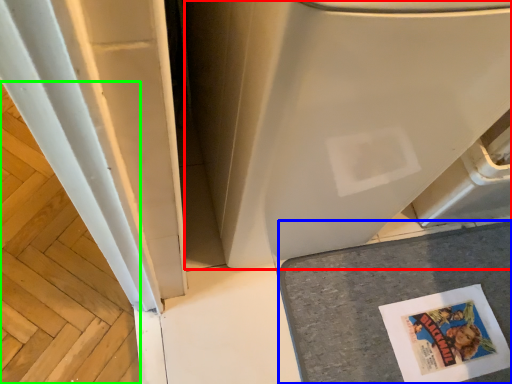
Question: Which object is positioned farthest from water heater (highlighted by a red box)? Select from counter top (highlighted by a blue box) and wood (highlighted by a green box).

Choices:
 (A) counter top
 (B) wood

Answer: (B)